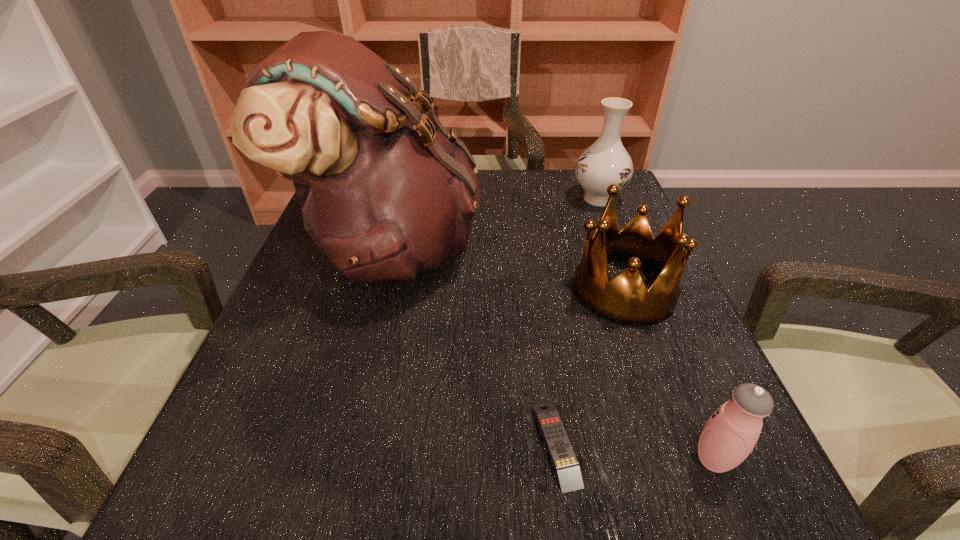
I want to click on free spot that satisfies the following two spatial constraints: 1. at the front of the leftmost object with buckles; 2. on the back side of the shortest object, so click(345, 444).

In order to click on vacant region that satisfies the following two spatial constraints: 1. at the front of the crown with buckles; 2. on the left side of the leftmost object in this screenshot , I will do `click(383, 289)`.

Find the location of `free space that satisfies the following two spatial constraints: 1. at the front of the leftmost object with buckles; 2. on the back side of the thermos bottle`. free space that satisfies the following two spatial constraints: 1. at the front of the leftmost object with buckles; 2. on the back side of the thermos bottle is located at coordinates (342, 460).

In order to click on free space that satisfies the following two spatial constraints: 1. at the front of the tallest object with buckles; 2. on the left side of the fourth tallest object in this screenshot , I will do `click(342, 460)`.

Image resolution: width=960 pixels, height=540 pixels. I want to click on vacant point that satisfies the following two spatial constraints: 1. at the front of the leftmost object with buckles; 2. on the left side of the shortest object, so click(x=345, y=444).

The height and width of the screenshot is (540, 960). Find the location of `vacant space that satisfies the following two spatial constraints: 1. on the back side of the remote control; 2. at the front of the tallest object with buckles`. vacant space that satisfies the following two spatial constraints: 1. on the back side of the remote control; 2. at the front of the tallest object with buckles is located at coordinates (529, 249).

Locate an element on the screen. Image resolution: width=960 pixels, height=540 pixels. free space in the image that satisfies the following two spatial constraints: 1. at the front of the thermos bottle with buckles; 2. on the left side of the tallest object is located at coordinates (342, 460).

The height and width of the screenshot is (540, 960). I want to click on vacant position in the image that satisfies the following two spatial constraints: 1. on the back side of the remote control; 2. at the front of the leftmost object with buckles, so click(529, 249).

At what (x,y) coordinates should I click in order to perform the action: click on free region that satisfies the following two spatial constraints: 1. on the front side of the vase; 2. at the front of the leftmost object with buckles. Please return your answer as a coordinate pair (x, y). This screenshot has height=540, width=960. Looking at the image, I should click on (617, 249).